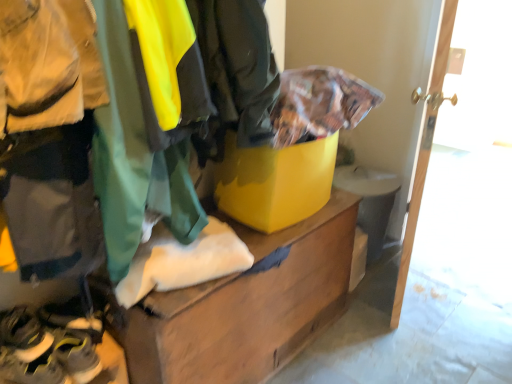
Where is `vacant area located to the right-hand side of wooden door at right`? vacant area located to the right-hand side of wooden door at right is located at coordinates (454, 288).